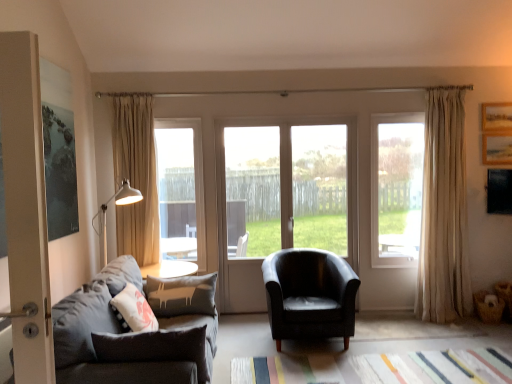
Question: Is wooden picture frame at upper right smaller than beige fabric curtain at left, acting as the 1th curtain starting from the left?

Choices:
 (A) yes
 (B) no

Answer: (A)

Question: From the image's perspective, does wooden picture frame at upper right appear higher than beige fabric curtain at left, acting as the 1th curtain starting from the left?

Choices:
 (A) no
 (B) yes

Answer: (B)

Question: From a real-world perspective, is wooden picture frame at upper right under beige fabric curtain at left, acting as the 1th curtain starting from the left?

Choices:
 (A) no
 (B) yes

Answer: (A)

Question: Is wooden picture frame at upper right facing away from beige fabric curtain at left, acting as the 1th curtain starting from the left?

Choices:
 (A) no
 (B) yes

Answer: (A)

Question: Can you confirm if wooden picture frame at upper right is wider than beige fabric curtain at left, acting as the 1th curtain starting from the left?

Choices:
 (A) yes
 (B) no

Answer: (B)

Question: Is wooden picture frame at upper right taller or shorter than dark gray fabric couch at left?

Choices:
 (A) short
 (B) tall

Answer: (A)

Question: Is wooden picture frame at upper right to the left or to the right of dark gray fabric couch at left in the image?

Choices:
 (A) left
 (B) right

Answer: (B)

Question: In the image, is wooden picture frame at upper right positioned in front of or behind dark gray fabric couch at left?

Choices:
 (A) behind
 (B) front

Answer: (A)

Question: From a real-world perspective, is wooden picture frame at upper right physically located above or below dark gray fabric couch at left?

Choices:
 (A) below
 (B) above

Answer: (B)

Question: Considering the positions of transparent glass door at center, which is the 2th window from left to right, and dark gray fabric couch at left in the image, is transparent glass door at center, which is the 2th window from left to right, taller or shorter than dark gray fabric couch at left?

Choices:
 (A) tall
 (B) short

Answer: (A)

Question: From a real-world perspective, relative to dark gray fabric couch at left, is transparent glass door at center, which ranks as the second window in right-to-left order, vertically above or below?

Choices:
 (A) below
 (B) above

Answer: (B)

Question: Is point (269, 200) closer or farther from the camera than point (58, 302)?

Choices:
 (A) closer
 (B) farther

Answer: (B)

Question: Is transparent glass door at center, which is the 2th window from left to right, to the left or to the right of dark gray fabric couch at left in the image?

Choices:
 (A) right
 (B) left

Answer: (A)

Question: Is clear glass window at center, the 3th window from the left, taller or shorter than black leather armchair at center?

Choices:
 (A) tall
 (B) short

Answer: (A)

Question: From a real-world perspective, relative to black leather armchair at center, is clear glass window at center, which is the 1th window from right to left, vertically above or below?

Choices:
 (A) above
 (B) below

Answer: (A)